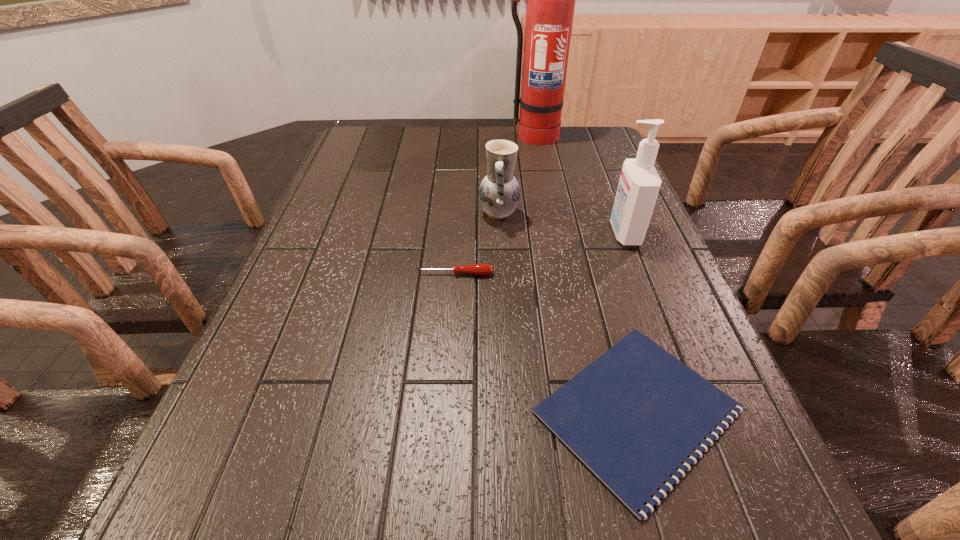
At what (x,y) coordinates should I click in order to perform the action: click on the tallest object. Please return your answer as a coordinate pair (x, y). Image resolution: width=960 pixels, height=540 pixels. Looking at the image, I should click on (550, 4).

At what (x,y) coordinates should I click in order to perform the action: click on the farthest object. Please return your answer as a coordinate pair (x, y). This screenshot has height=540, width=960. Looking at the image, I should click on (550, 4).

What are the coordinates of `the fourth shortest object` in the screenshot? It's located at (639, 184).

Find the location of a particular element. This screenshot has width=960, height=540. pottery is located at coordinates (499, 193).

The height and width of the screenshot is (540, 960). What are the coordinates of `the second shortest object` in the screenshot? It's located at (475, 269).

This screenshot has height=540, width=960. In order to click on the fourth farthest object in this screenshot , I will do `click(475, 269)`.

Locate an element on the screen. The height and width of the screenshot is (540, 960). notepad is located at coordinates (632, 416).

The image size is (960, 540). In order to click on the shortest object in this screenshot , I will do `click(632, 416)`.

What are the coordinates of `vacant space situated on the label side of the fire extinguisher` in the screenshot? It's located at pos(548,217).

Where is `free space located 0.160m on the front label of the fourth shortest object`? This screenshot has width=960, height=540. free space located 0.160m on the front label of the fourth shortest object is located at coordinates (544, 233).